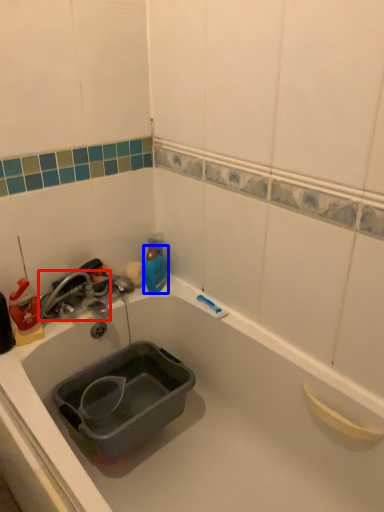
Question: Which object appears farthest to the camera in this image, tap (highlighted by a red box) or bottle (highlighted by a blue box)?

Choices:
 (A) tap
 (B) bottle

Answer: (B)